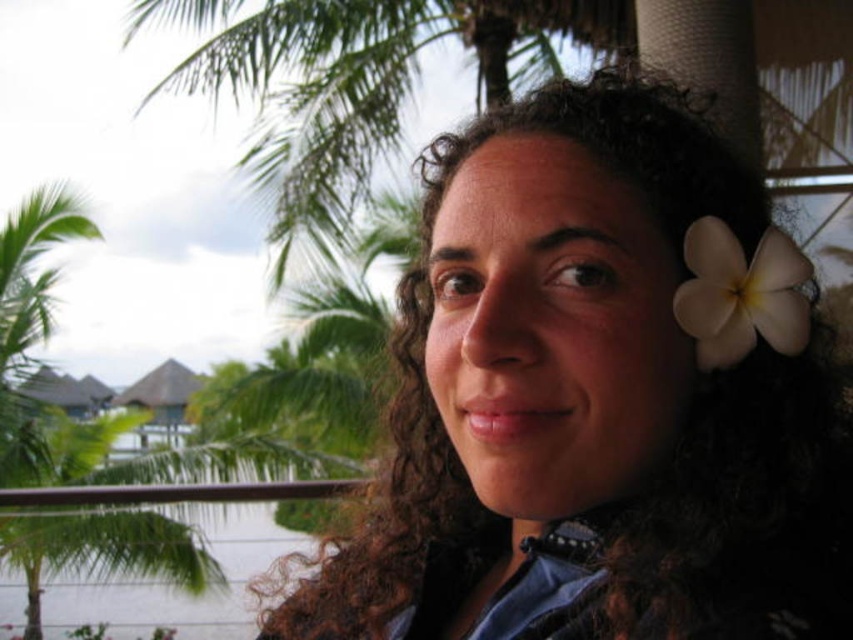
You are a photographer trying to capture a portrait of the person in the scene. You want to ensure that the matte black hair at center and the white matte flower at upper right are both clearly visible in the frame. Given their positions and sizes, which object should you focus on first to ensure both are in focus?

The matte black hair at center is taller than the white matte flower at upper right. To ensure both are in focus, you should focus on the matte black hair at center first since it is larger and closer to the camera, which will help keep the flower in the background also sharp.

You are a photographer trying to capture a portrait of the person with matte black hair at center while ensuring the green leafy palm tree at upper left is visible in the background. Based on their positions, will the palm tree appear below or above the person in the photo?

The palm tree will appear below the person in the photo because the matte black hair at center is above the green leafy palm tree at upper left.

You are a photographer trying to capture a closeup shot of the matte black hair at center and the white matte flower at upper right. Given that your camera can focus on objects within a 4 inch range, will both subjects be in focus?

The matte black hair at center is 4.19 inches away from the white matte flower at upper right. Since the distance between them exceeds the camera focus range of 4 inches, both subjects may not be in focus simultaneously.